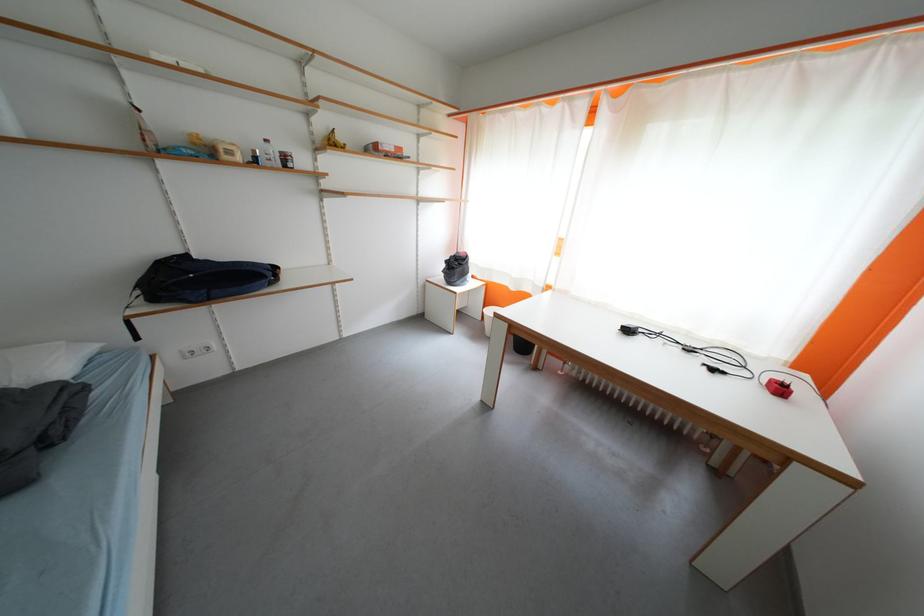
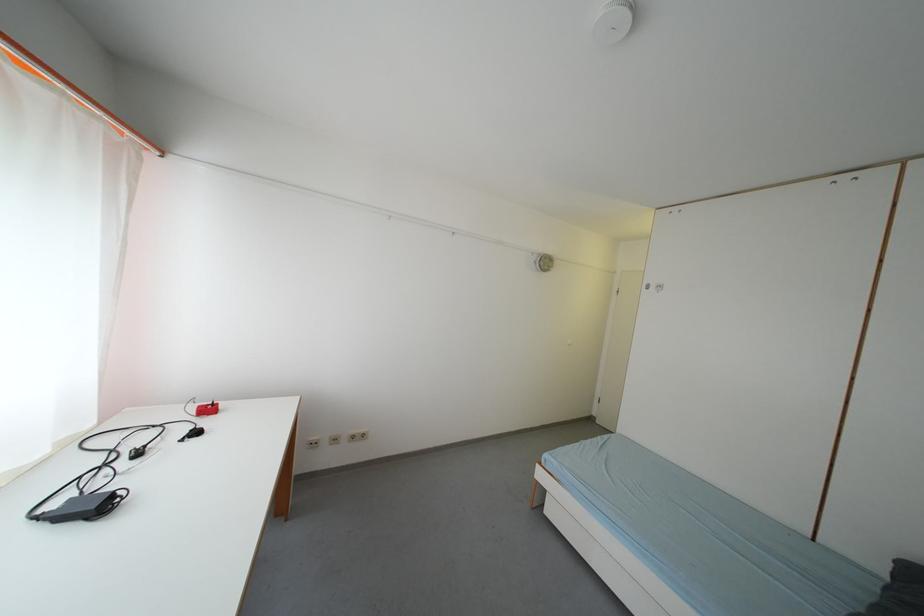
Where in the second image is the point corresponding to (x=687, y=346) from the first image?

(112, 469)